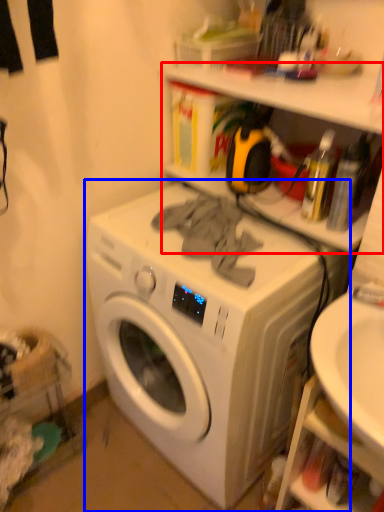
Question: Which object is closer to the camera taking this photo, shelf (highlighted by a red box) or washing machine (highlighted by a blue box)?

Choices:
 (A) shelf
 (B) washing machine

Answer: (B)